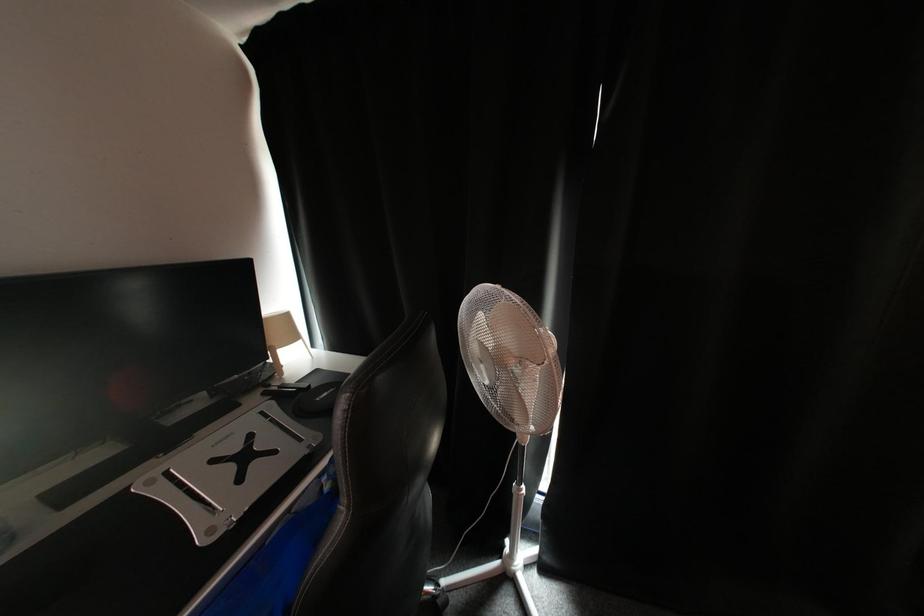
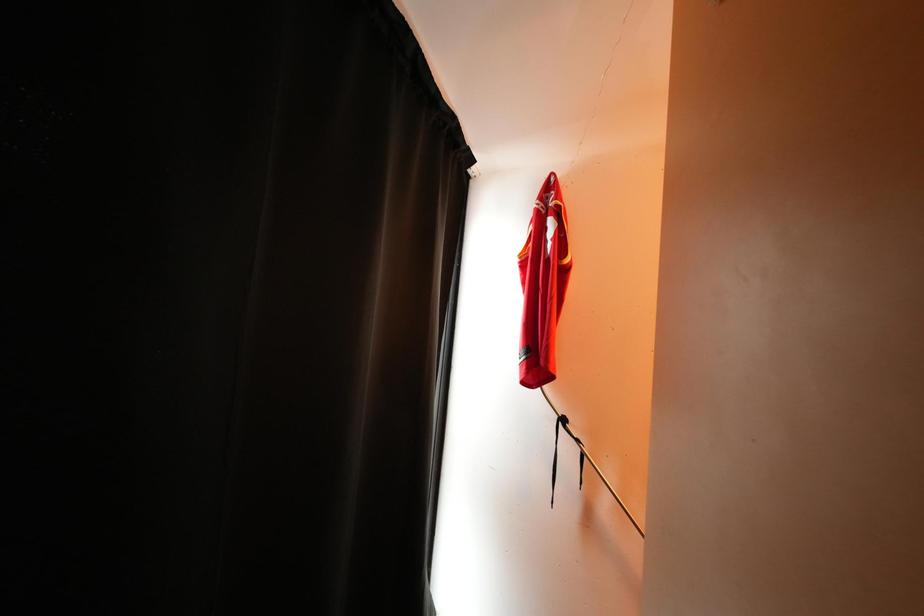
Question: The camera is either moving clockwise (left) or counter-clockwise (right) around the object. The first image is from the beginning of the video and the second image is from the end. Is the camera moving left or right when shooting the video?

Choices:
 (A) Left
 (B) Right

Answer: (A)